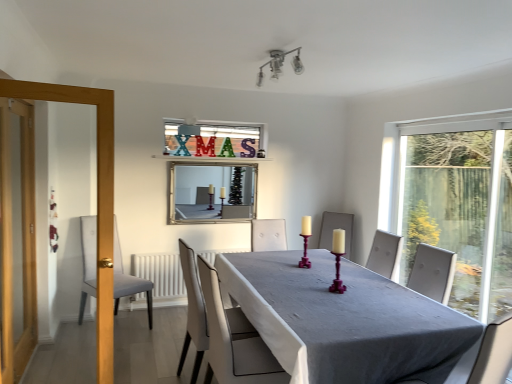
Question: Should I look upward or downward to see silver/glass mirror at upper center?

Choices:
 (A) down
 (B) up

Answer: (B)

Question: Is transparent glass window at right thinner than wooden screen door at left?

Choices:
 (A) yes
 (B) no

Answer: (A)

Question: Is transparent glass window at right positioned beyond the bounds of wooden screen door at left?

Choices:
 (A) yes
 (B) no

Answer: (A)

Question: Is transparent glass window at right directly adjacent to wooden screen door at left?

Choices:
 (A) no
 (B) yes

Answer: (A)

Question: From the image's perspective, is transparent glass window at right beneath wooden screen door at left?

Choices:
 (A) no
 (B) yes

Answer: (A)

Question: Is transparent glass window at right at the right side of wooden screen door at left?

Choices:
 (A) yes
 (B) no

Answer: (A)

Question: From a real-world perspective, is transparent glass window at right located beneath wooden screen door at left?

Choices:
 (A) no
 (B) yes

Answer: (A)

Question: Is purple wood candle holder at center, placed as the 2th candle holder when sorted from right to left, behind wooden screen door at left?

Choices:
 (A) no
 (B) yes

Answer: (B)

Question: From the image's perspective, does purple wood candle holder at center, the first candle holder from the left, appear lower than wooden screen door at left?

Choices:
 (A) no
 (B) yes

Answer: (B)

Question: Can you confirm if purple wood candle holder at center, positioned as the 1th candle holder in back-to-front order, is wider than wooden screen door at left?

Choices:
 (A) no
 (B) yes

Answer: (A)

Question: Considering the relative positions of purple wood candle holder at center, the second candle holder in the front-to-back sequence, and wooden screen door at left in the image provided, is purple wood candle holder at center, the second candle holder in the front-to-back sequence, to the left of wooden screen door at left from the viewer's perspective?

Choices:
 (A) yes
 (B) no

Answer: (B)

Question: Can you confirm if purple wood candle holder at center, the first candle holder from the left, is taller than wooden screen door at left?

Choices:
 (A) yes
 (B) no

Answer: (B)

Question: Is there a large distance between purple wood candle holder at center, positioned as the 1th candle holder in back-to-front order, and wooden screen door at left?

Choices:
 (A) yes
 (B) no

Answer: (A)

Question: Is wooden screen door at left oriented towards purple wood candle holder at center, placed as the 2th candle holder when sorted from right to left?

Choices:
 (A) no
 (B) yes

Answer: (A)